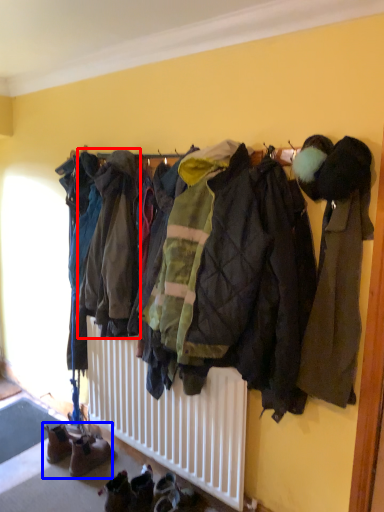
Question: Which object appears closest to the camera in this image, jacket (highlighted by a red box) or footwear (highlighted by a blue box)?

Choices:
 (A) jacket
 (B) footwear

Answer: (A)